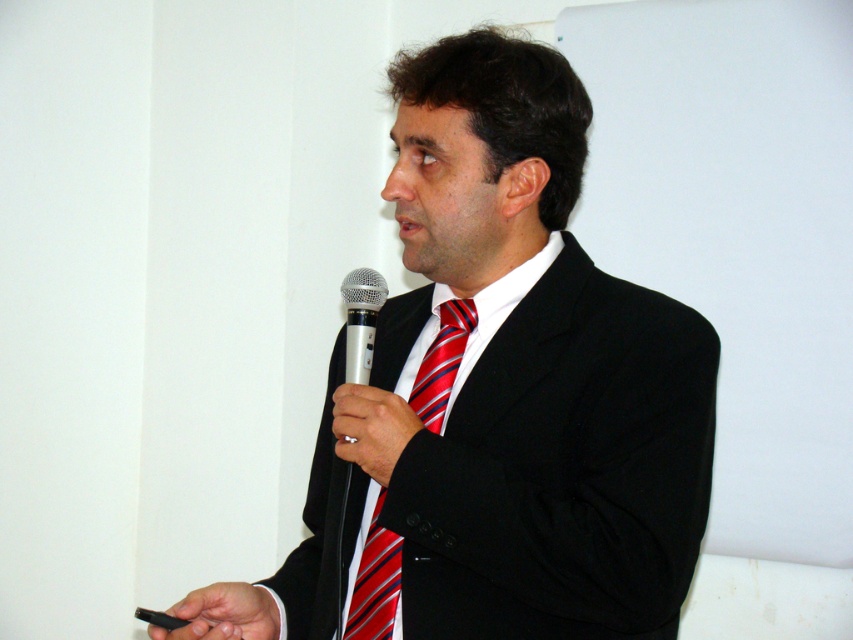
Question: Is black matte suit at center wider than silver metallic microphone at center?

Choices:
 (A) yes
 (B) no

Answer: (A)

Question: Is black matte usb drive at lower left to the right of silver metallic microphone at center from the viewer's perspective?

Choices:
 (A) no
 (B) yes

Answer: (A)

Question: Observing the image, what is the correct spatial positioning of red striped tie at center in reference to smooth black hand at center?

Choices:
 (A) above
 (B) below

Answer: (B)

Question: Based on their relative distances, which object is farther from the smooth black hand at center?

Choices:
 (A) black matte usb drive at lower left
 (B) black matte suit at center
 (C) red striped tie at center
 (D) silver metallic microphone at center

Answer: (A)

Question: Estimate the real-world distances between objects in this image. Which object is closer to the red striped tie at center?

Choices:
 (A) black matte suit at center
 (B) black matte usb drive at lower left
 (C) smooth black hand at center
 (D) silver metallic microphone at center

Answer: (C)

Question: Among these points, which one is nearest to the camera?

Choices:
 (A) pos(682,337)
 (B) pos(369,534)
 (C) pos(215,605)
 (D) pos(392,403)

Answer: (A)